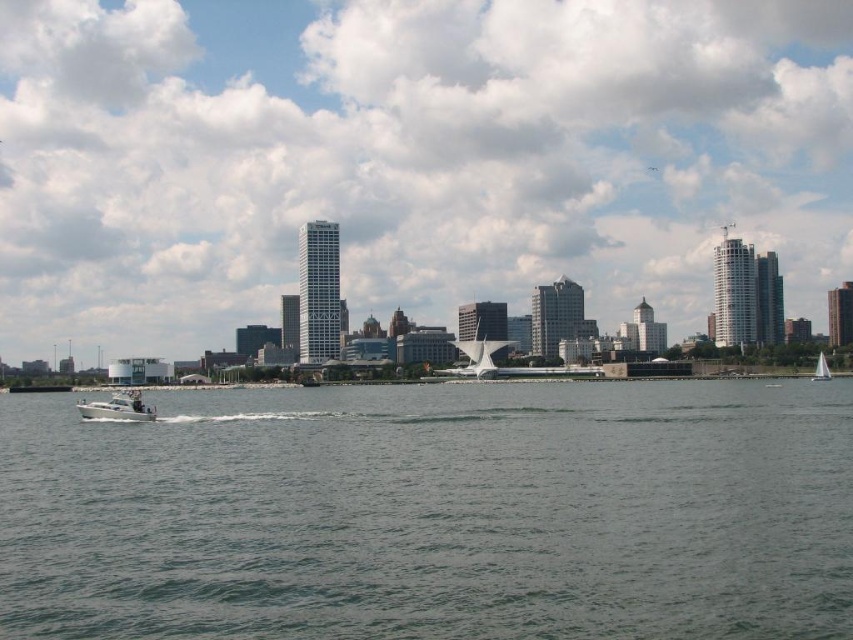
Question: Can you confirm if greenish-blue water at center is bigger than white sailboat at lower right?

Choices:
 (A) yes
 (B) no

Answer: (A)

Question: Which of the following is the closest to the observer?

Choices:
 (A) (491, 122)
 (B) (708, 388)
 (C) (817, 369)

Answer: (B)

Question: In this image, where is greenish-blue water at center located relative to white sailboat at lower right?

Choices:
 (A) left
 (B) right

Answer: (A)

Question: Which point appears farthest from the camera in this image?

Choices:
 (A) (643, 618)
 (B) (821, 378)

Answer: (B)

Question: Does greenish-blue water at center have a lesser width compared to white glossy motorboat at lower left?

Choices:
 (A) no
 (B) yes

Answer: (A)

Question: Which of the following is the farthest from the observer?

Choices:
 (A) greenish-blue water at center
 (B) matte glass skyscrapers at center

Answer: (B)